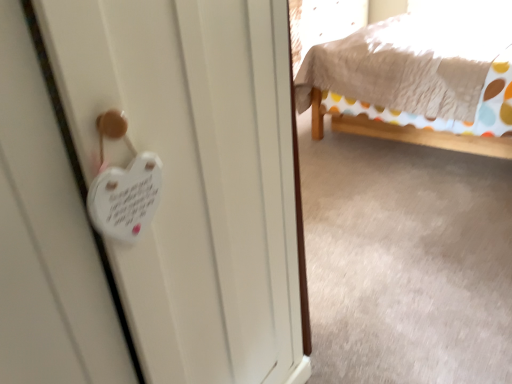
Image resolution: width=512 pixels, height=384 pixels. Describe the element at coordinates (420, 78) in the screenshot. I see `textured beige bed at upper right` at that location.

This screenshot has height=384, width=512. What are the coordinates of `textured beige bed at upper right` in the screenshot? It's located at point(420,78).

This screenshot has height=384, width=512. I want to click on textured beige bed at upper right, so click(420, 78).